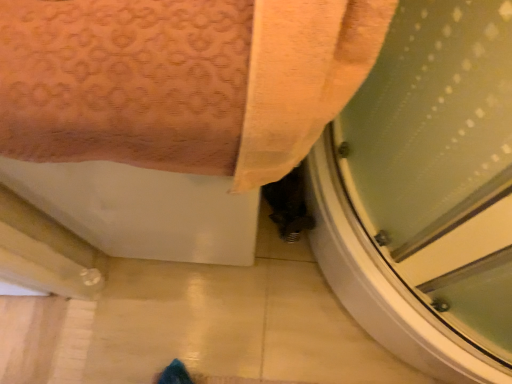
Question: Considering the positions of matte pink towel at upper left and transparent plastic screen door at lower right in the image, is matte pink towel at upper left wider or thinner than transparent plastic screen door at lower right?

Choices:
 (A) wide
 (B) thin

Answer: (A)

Question: Considering the positions of matte pink towel at upper left and transparent plastic screen door at lower right in the image, is matte pink towel at upper left taller or shorter than transparent plastic screen door at lower right?

Choices:
 (A) tall
 (B) short

Answer: (A)

Question: Does point (71, 148) appear closer or farther from the camera than point (497, 269)?

Choices:
 (A) closer
 (B) farther

Answer: (A)

Question: From the image's perspective, is transparent plastic screen door at lower right positioned above or below matte pink towel at upper left?

Choices:
 (A) below
 (B) above

Answer: (A)

Question: Is transparent plastic screen door at lower right in front of or behind matte pink towel at upper left in the image?

Choices:
 (A) behind
 (B) front

Answer: (A)

Question: Is transparent plastic screen door at lower right wider or thinner than matte pink towel at upper left?

Choices:
 (A) thin
 (B) wide

Answer: (A)

Question: From a real-world perspective, is transparent plastic screen door at lower right above or below matte pink towel at upper left?

Choices:
 (A) below
 (B) above

Answer: (A)